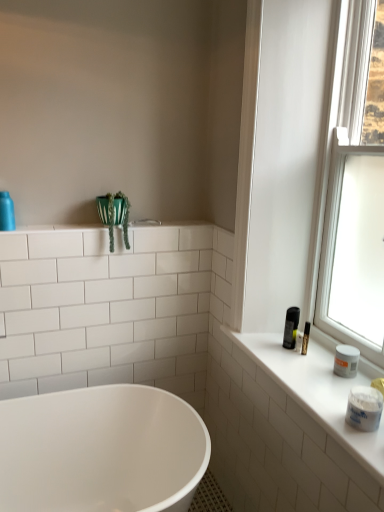
Where is `free point to the right of matte blue bottle at upper left, which is counted as the second toiletry, starting from the right`? This screenshot has height=512, width=384. free point to the right of matte blue bottle at upper left, which is counted as the second toiletry, starting from the right is located at coordinates (47, 227).